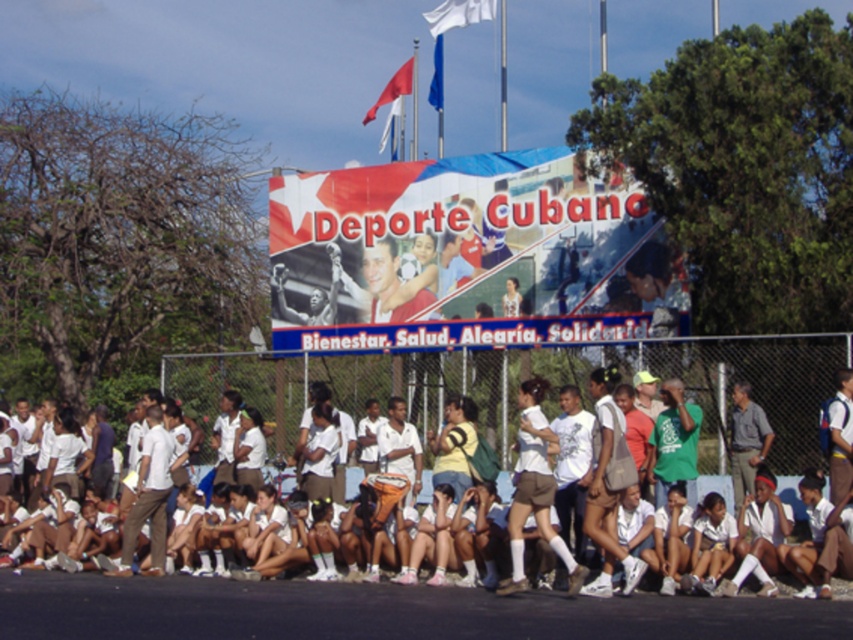
Question: Is white cotton shirt at center positioned at the back of red fabric flag at upper center?

Choices:
 (A) no
 (B) yes

Answer: (A)

Question: Which point is closer to the camera?

Choices:
 (A) (306, 256)
 (B) (763, 416)
 (C) (436, 52)

Answer: (B)

Question: Does matte plastic banner at center have a lesser width compared to white cotton shirt at center?

Choices:
 (A) no
 (B) yes

Answer: (B)

Question: Observing the image, what is the correct spatial positioning of white fabric flag at upper center in reference to red fabric flag at upper center?

Choices:
 (A) below
 (B) above

Answer: (B)

Question: Among these points, which one is farthest from the camera?

Choices:
 (A) (402, 88)
 (B) (430, 84)

Answer: (B)

Question: Among these points, which one is nearest to the camera?

Choices:
 (A) (734, 512)
 (B) (553, 188)
 (C) (352, 401)

Answer: (A)